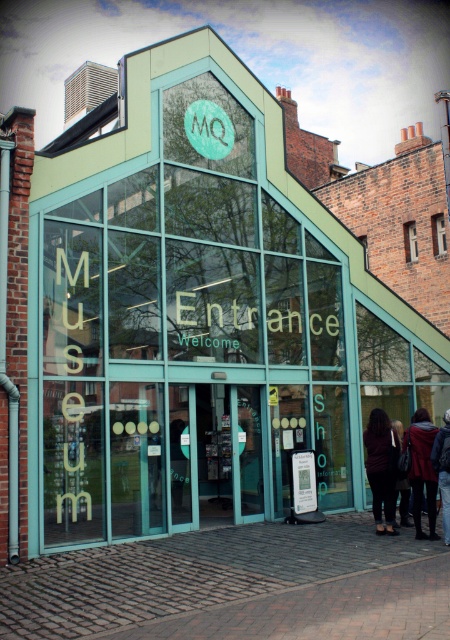
You are standing outside the MQ Museum entrance. You notice a clear glass window at center and a brick wall at upper center. Which object is taller?

The brick wall at upper center is taller than the clear glass window at center.

You are standing at the entrance of MQ Museum. You want to take a photo of the entrance sign located at point [428,476]. If your camera has a focal length of 50mm and you are 13.39 meters away from the sign, what is the approximate angle of view needed to capture the entire sign in your photo?

The camera is 13.39 meters away from the point [428,476]. To capture the entire sign at that distance, you would need an angle of view that accommodates the sign within the frame. However, without knowing the physical dimensions of the sign or the sensor size of the camera, an exact angle cannot be calculated. Ensure you position yourself appropriately to include the entire sign in your shot.